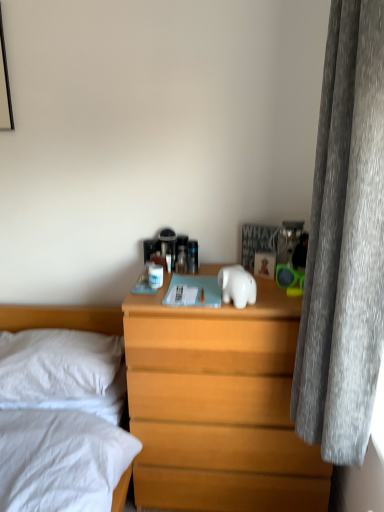
Identify the location of wooden nightstand at center. Image resolution: width=384 pixels, height=512 pixels. (218, 406).

What do you see at coordinates (237, 286) in the screenshot? I see `white glossy elephant at center` at bounding box center [237, 286].

Measure the distance between white soft pillow at left and camera.

1.72 meters.

At what (x,y) coordinates should I click in order to perform the action: click on wooden nightstand at center. Please return your answer as a coordinate pair (x, y). The width and height of the screenshot is (384, 512). Looking at the image, I should click on (218, 406).

What's the angular difference between white glossy elephant at center and wooden nightstand at center's facing directions?

47.1 degrees.

From the image's perspective, is white glossy elephant at center on wooden nightstand at center?

Yes, from the image's perspective, white glossy elephant at center is above wooden nightstand at center.

Between white glossy elephant at center and wooden nightstand at center, which one has larger width?

wooden nightstand at center is wider.

From the picture: Which object is more forward, white glossy elephant at center or wooden nightstand at center?

white glossy elephant at center is in front.

There is a white soft pillow at left. Where is `curtain above it (from a real-world perspective)`? curtain above it (from a real-world perspective) is located at coordinates (345, 243).

Can you tell me how much gray velvet curtain at right and white soft pillow at left differ in facing direction?

90.1 degrees.

Is gray velvet curtain at right further to the viewer compared to white soft pillow at left?

No.

Is wooden nightstand at center with gray velvet curtain at right?

No, wooden nightstand at center is not next to gray velvet curtain at right.

Visually, is wooden nightstand at center positioned to the left or to the right of gray velvet curtain at right?

wooden nightstand at center is to the left of gray velvet curtain at right.

Between wooden nightstand at center and gray velvet curtain at right, which one has larger size?

With larger size is wooden nightstand at center.

Which object is more forward, gray velvet curtain at right or white glossy elephant at center?

gray velvet curtain at right is in front.

Which object is positioned more to the right, gray velvet curtain at right or white glossy elephant at center?

From the viewer's perspective, gray velvet curtain at right appears more on the right side.

From a real-world perspective, relative to white glossy elephant at center, is gray velvet curtain at right vertically above or below?

gray velvet curtain at right is above white glossy elephant at center.

There is a white glossy elephant at center. At what (x,y) coordinates should I click in order to perform the action: click on curtain above it (from a real-world perspective). Please return your answer as a coordinate pair (x, y). Image resolution: width=384 pixels, height=512 pixels. Looking at the image, I should click on (345, 243).

From the image's perspective, is white glossy elephant at center on top of white soft pillow at left?

Yes, from the image's perspective, white glossy elephant at center is above white soft pillow at left.

This screenshot has width=384, height=512. I want to click on animal that is above the white soft pillow at left (from the image's perspective), so click(237, 286).

Is point (237, 291) more distant than point (81, 368)?

No.

Are white soft pillow at left and gray velvet curtain at right located far from each other?

Yes, white soft pillow at left and gray velvet curtain at right are located far from each other.

From a real-world perspective, is white soft pillow at left positioned under gray velvet curtain at right based on gravity?

Yes, from a real-world perspective, white soft pillow at left is beneath gray velvet curtain at right.

Does white soft pillow at left lie behind gray velvet curtain at right?

Yes, it is.

Which of these two, gray velvet curtain at right or wooden nightstand at center, is smaller?

With smaller size is gray velvet curtain at right.

What's the angular difference between gray velvet curtain at right and wooden nightstand at center's facing directions?

The facing directions of gray velvet curtain at right and wooden nightstand at center are 90 degrees apart.

Is gray velvet curtain at right outside of wooden nightstand at center?

gray velvet curtain at right is positioned outside wooden nightstand at center.

Is point (364, 181) in front of point (182, 446)?

Yes, it is.

Locate an element on the screen. animal on the left of wooden nightstand at center is located at coordinates (237, 286).

Where is `curtain in front of the white soft pillow at left`? Image resolution: width=384 pixels, height=512 pixels. curtain in front of the white soft pillow at left is located at coordinates (345, 243).

When comparing their distances from white glossy elephant at center, does white soft pillow at left or wooden nightstand at center seem further?

white soft pillow at left is positioned further to the anchor white glossy elephant at center.

Which object lies nearer to the anchor point white soft pillow at left, white glossy elephant at center or gray velvet curtain at right?

white glossy elephant at center.

Considering their positions, is white soft pillow at left positioned closer to gray velvet curtain at right than white glossy elephant at center?

Based on the image, white glossy elephant at center appears to be nearer to gray velvet curtain at right.

From the image, which object appears to be farther from white soft pillow at left, white glossy elephant at center or wooden nightstand at center?

The object further to white soft pillow at left is white glossy elephant at center.

When comparing their distances from wooden nightstand at center, does gray velvet curtain at right or white soft pillow at left seem closer?

Based on the image, gray velvet curtain at right appears to be nearer to wooden nightstand at center.

From the image, which object appears to be farther from white soft pillow at left, gray velvet curtain at right or white glossy elephant at center?

The object further to white soft pillow at left is gray velvet curtain at right.

Estimate the real-world distances between objects in this image. Which object is closer to wooden nightstand at center, white glossy elephant at center or gray velvet curtain at right?

Based on the image, white glossy elephant at center appears to be nearer to wooden nightstand at center.

Based on their spatial positions, is gray velvet curtain at right or white glossy elephant at center further from wooden nightstand at center?

gray velvet curtain at right is positioned further to the anchor wooden nightstand at center.

Find the location of a particular element. animal positioned between gray velvet curtain at right and wooden nightstand at center from near to far is located at coordinates (237, 286).

Identify the location of nightstand located between white soft pillow at left and gray velvet curtain at right in the left-right direction. The width and height of the screenshot is (384, 512). (218, 406).

The image size is (384, 512). What are the coordinates of `animal between white soft pillow at left and wooden nightstand at center from left to right` in the screenshot? It's located at (237, 286).

Locate an element on the screen. animal between white soft pillow at left and gray velvet curtain at right is located at coordinates (237, 286).